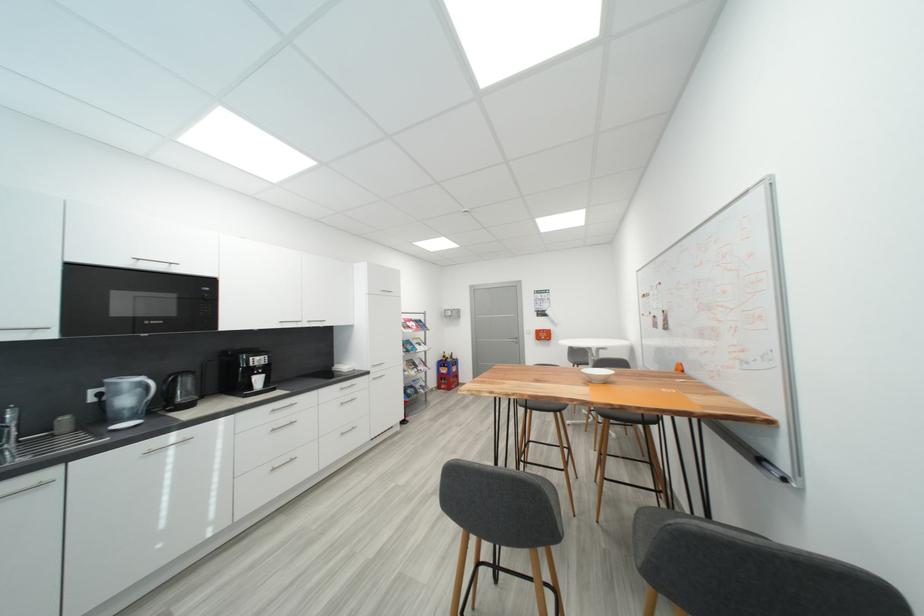
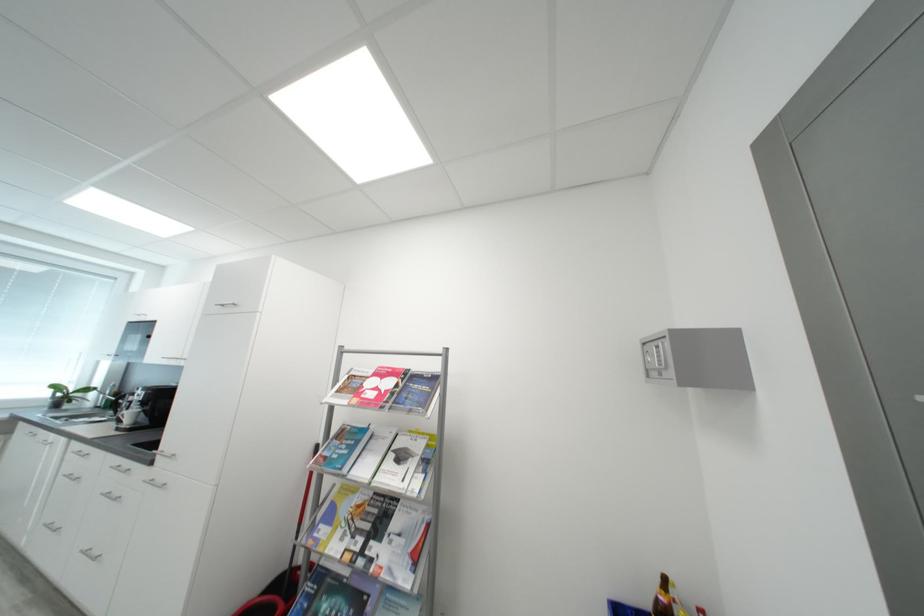
In the second image, find the point that corresponds to pixel 265 382 in the first image.

(138, 416)